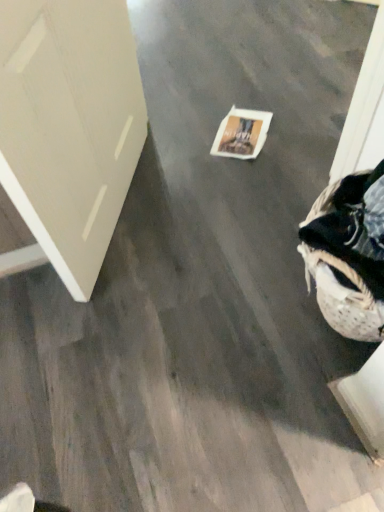
What do you see at coordinates (69, 128) in the screenshot?
I see `white matte door at left` at bounding box center [69, 128].

Identify the location of white matte door at left. The image size is (384, 512). (69, 128).

Where is `white matte door at left`? The image size is (384, 512). white matte door at left is located at coordinates pos(69,128).